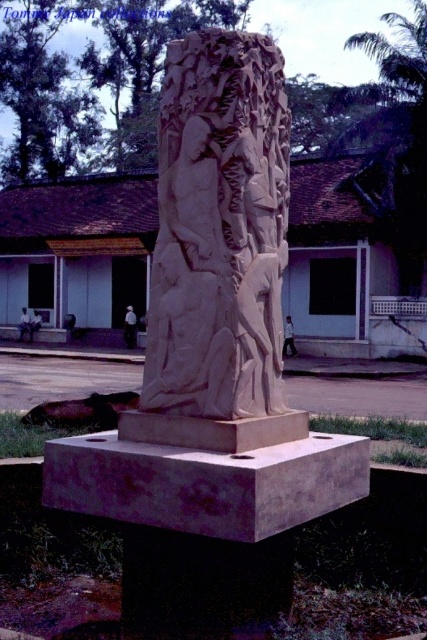
You are standing in front of the monument and want to touch both the sandstone sculpture at center and the sandstone carving at center. Which one can you reach first without moving your position?

The sandstone sculpture at center is closer to you than the sandstone carving at center, so you can reach it first without moving your position.

You are an art curator planning to display both the sandstone sculpture at center and the smooth stone sculpture at center in an exhibition. Which sculpture should be placed on a higher pedestal to ensure both are visible from the front entrance?

The sandstone sculpture at center is taller than the smooth stone sculpture at center, so placing the smooth stone sculpture at center on a higher pedestal would help balance their overall heights for visibility from the front entrance.